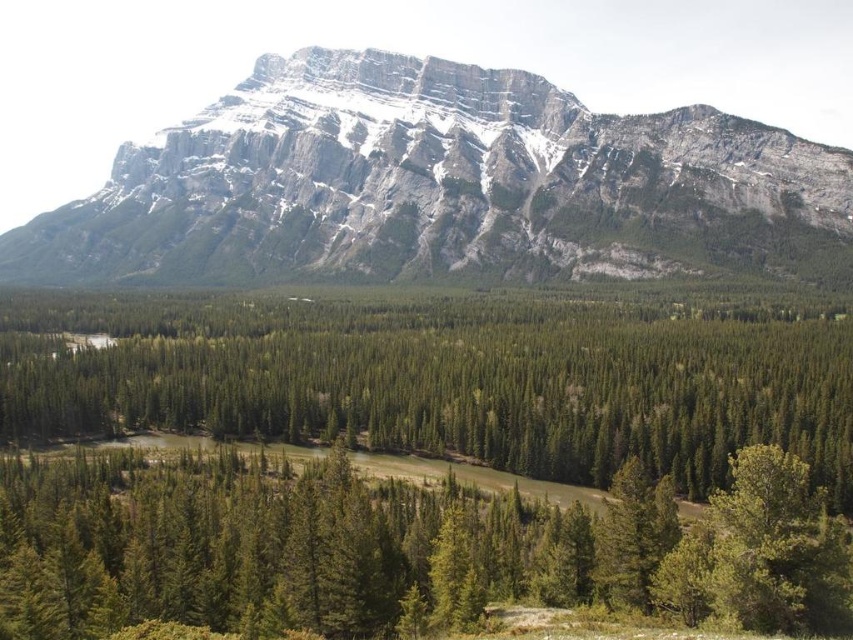
You are a hiker planning to cross the small body of water in the image. To ensure safety, you need to know which object is taller between the green textured forest at center and the green matte tree at lower right. Could you tell me which one is taller?

The green textured forest at center is taller than the green matte tree at lower right according to the description.

You are an explorer trying to navigate through the forest. You see the green textured forest at center and the green matte tree at lower center. Which one is closer to you?

The green matte tree at lower center is closer to you because the green textured forest at center is further away.

You are standing in the forest looking towards the mountains. There are two points marked in the image, one at coordinates point (752, 442) and another at point (630, 588). Which point is closer to you?

Point (630, 588) is closer to you because it is less further to the camera than point (752, 442).